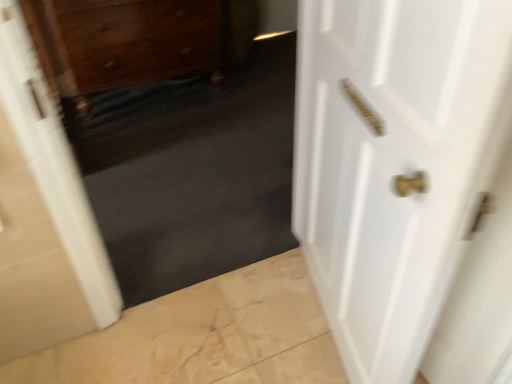
Find the location of `free point below wooden drawer at upper left (from a real-world perspective)`. free point below wooden drawer at upper left (from a real-world perspective) is located at coordinates (147, 101).